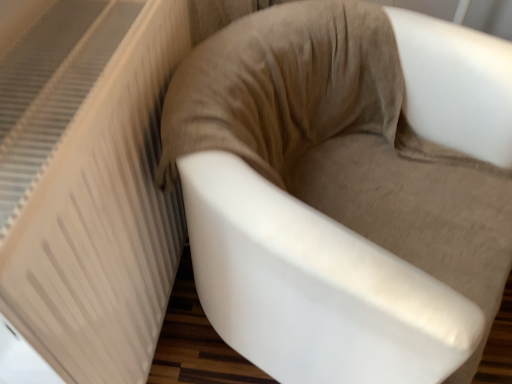
Locate an element on the screen. Image resolution: width=512 pixels, height=384 pixels. white textured radiator at left is located at coordinates (89, 186).

Describe the element at coordinates (89, 186) in the screenshot. I see `white textured radiator at left` at that location.

The height and width of the screenshot is (384, 512). Identify the location of suede-like beige chair at center. tap(331, 204).

What do you see at coordinates (331, 204) in the screenshot? I see `suede-like beige chair at center` at bounding box center [331, 204].

This screenshot has width=512, height=384. Identify the location of white textured radiator at left. (89, 186).

Is white textured radiator at left to the left or to the right of suede-like beige chair at center in the image?

Based on their positions, white textured radiator at left is located to the left of suede-like beige chair at center.

Considering their positions, is white textured radiator at left located in front of or behind suede-like beige chair at center?

In the image, white textured radiator at left appears in front of suede-like beige chair at center.

Considering the positions of points (114, 268) and (262, 269), is point (114, 268) farther from camera compared to point (262, 269)?

Yes, it is behind point (262, 269).

From the image's perspective, is white textured radiator at left positioned above or below suede-like beige chair at center?

Clearly, from the image's perspective, white textured radiator at left is above suede-like beige chair at center.

From a real-world perspective, between white textured radiator at left and suede-like beige chair at center, who is vertically higher?

white textured radiator at left, from a real-world perspective.

Can you confirm if white textured radiator at left is wider than suede-like beige chair at center?

In fact, white textured radiator at left might be narrower than suede-like beige chair at center.

Considering the sizes of objects white textured radiator at left and suede-like beige chair at center in the image provided, who is taller, white textured radiator at left or suede-like beige chair at center?

Standing taller between the two is white textured radiator at left.

Which of these two, white textured radiator at left or suede-like beige chair at center, is bigger?

With larger size is suede-like beige chair at center.

Would you say white textured radiator at left is inside or outside suede-like beige chair at center?

The correct answer is: outside.

Is the surface of white textured radiator at left in direct contact with suede-like beige chair at center?

No, white textured radiator at left is not making contact with suede-like beige chair at center.

Is white textured radiator at left turned away from suede-like beige chair at center?

That's right, white textured radiator at left is facing away from suede-like beige chair at center.

What's the angular difference between white textured radiator at left and suede-like beige chair at center's facing directions?

27 degrees.

How distant is white textured radiator at left from suede-like beige chair at center?

white textured radiator at left is 9.61 inches away from suede-like beige chair at center.

Where is `radiator to the left of suede-like beige chair at center`? The width and height of the screenshot is (512, 384). radiator to the left of suede-like beige chair at center is located at coordinates (89, 186).

Consider the image. Can you confirm if suede-like beige chair at center is positioned to the right of white textured radiator at left?

Yes.

Is suede-like beige chair at center further to camera compared to white textured radiator at left?

Yes, it is.

Does point (334, 115) lie in front of point (59, 192)?

No.

From the image's perspective, between suede-like beige chair at center and white textured radiator at left, who is located below?

suede-like beige chair at center is shown below in the image.

From a real-world perspective, is suede-like beige chair at center physically located above or below white textured radiator at left?

From a real-world perspective, suede-like beige chair at center is physically below white textured radiator at left.

In terms of width, does suede-like beige chair at center look wider or thinner when compared to white textured radiator at left?

Considering their sizes, suede-like beige chair at center looks broader than white textured radiator at left.

Between suede-like beige chair at center and white textured radiator at left, which one has less height?

suede-like beige chair at center is shorter.

Based on their sizes in the image, would you say suede-like beige chair at center is bigger or smaller than white textured radiator at left?

Clearly, suede-like beige chair at center is larger in size than white textured radiator at left.

Can we say suede-like beige chair at center lies outside white textured radiator at left?

suede-like beige chair at center is positioned outside white textured radiator at left.

Is suede-like beige chair at center directly adjacent to white textured radiator at left?

suede-like beige chair at center and white textured radiator at left are not in contact.

Consider the image. Is suede-like beige chair at center turned away from white textured radiator at left?

Yes.

How different are the orientations of suede-like beige chair at center and white textured radiator at left in degrees?

They differ by 27 degrees in their facing directions.

Locate an element on the screen. The height and width of the screenshot is (384, 512). chair behind the white textured radiator at left is located at coordinates (331, 204).

You are a GUI agent. You are given a task and a screenshot of the screen. Output one action in this format:
    pyautogui.click(x=<x>, y=<y>)
    Task: Click on the chair that is under the white textured radiator at left (from a real-world perspective)
    The height and width of the screenshot is (384, 512).
    Given the screenshot: What is the action you would take?
    pyautogui.click(x=331, y=204)

Locate an element on the screen. The image size is (512, 384). radiator located above the suede-like beige chair at center (from the image's perspective) is located at coordinates (89, 186).